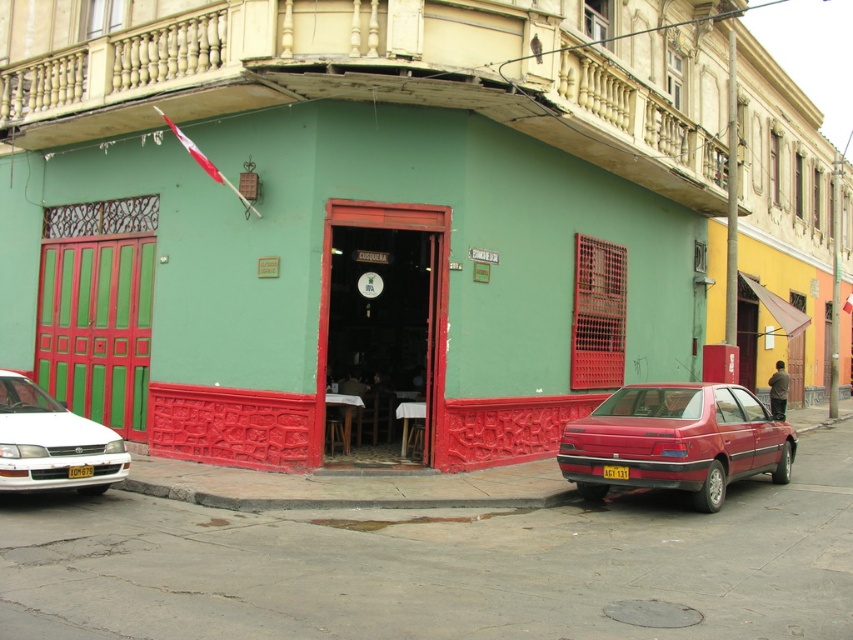
You are standing in front of the building with the red entrance and light green facade. You see two points marked on the building. One is at coordinate point (703, 432) and the other is at point (103, 444). Which point is closer to you?

Point (103, 444) is closer to you because it is less further to the camera than point (703, 432).

You are a delivery person trying to park your van between the glossy red car at lower right and the white glossy sedan at left. Can you fit your van, which is 2.5 meters wide, in the space between them?

The glossy red car at lower right is wider than the white glossy sedan at left, so the combined width of both cars would be greater than the space available. Therefore, your van may not fit comfortably between them.

You are standing at the entrance of the building with the red door and want to park your car at the spot closest to the entrance. Is the glossy red car at lower right blocking your desired parking spot?

The glossy red car at lower right is located at point (676, 442), which is not directly in front of the entrance. Therefore, it is unlikely to be blocking your desired parking spot.